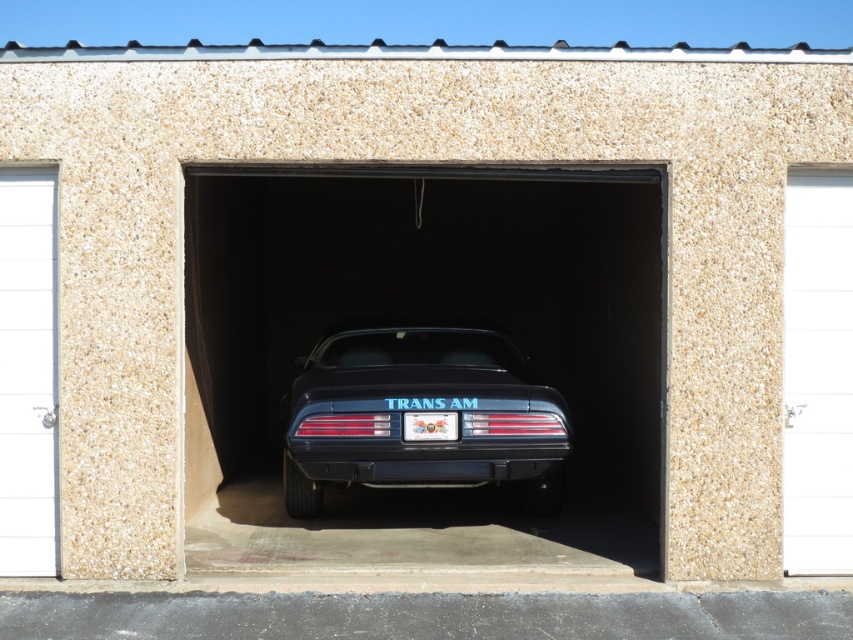
Question: Does glossy black car at center appear over white smooth door at left?

Choices:
 (A) no
 (B) yes

Answer: (A)

Question: Among these objects, which one is nearest to the camera?

Choices:
 (A) glossy black trans am at center
 (B) white smooth door at left
 (C) metallic silver license plate at center

Answer: (B)

Question: Which point is farther to the camera?

Choices:
 (A) white textured door at right
 (B) white smooth door at left
 (C) glossy black trans am at center

Answer: (C)

Question: Does glossy black car at center appear under metallic silver license plate at center?

Choices:
 (A) yes
 (B) no

Answer: (B)

Question: Which of the following is the closest to the observer?

Choices:
 (A) white textured door at right
 (B) white smooth door at left
 (C) metallic silver license plate at center
 (D) glossy black car at center

Answer: (B)

Question: Considering the relative positions of glossy black car at center and white smooth door at left in the image provided, where is glossy black car at center located with respect to white smooth door at left?

Choices:
 (A) above
 (B) below

Answer: (B)